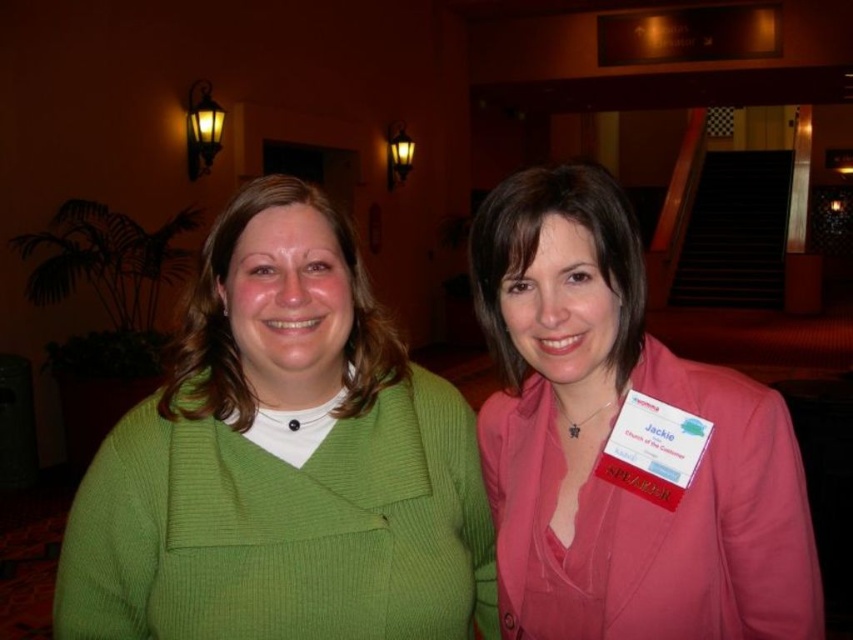
In the scene shown: You are standing at the entrance of the conference room and want to take a photo of the green ribbed sweater at center. The camera you have can focus on objects within 30 inches. Will the sweater be in focus?

The distance between the green ribbed sweater at center and the camera is 31.37 inches, which is beyond the camera focus range of 30 inches. The sweater will not be in focus.